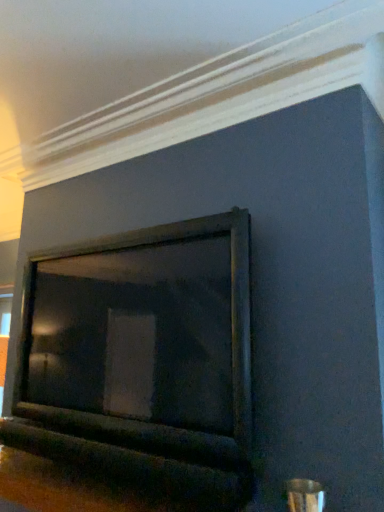
At what (x,y) coordinates should I click in order to perform the action: click on metallic silver fireplace at center. Please return your answer as a coordinate pair (x, y). Looking at the image, I should click on (138, 369).

This screenshot has width=384, height=512. What do you see at coordinates (138, 369) in the screenshot?
I see `metallic silver fireplace at center` at bounding box center [138, 369].

Measure the distance between metallic silver fireplace at center and camera.

The distance of metallic silver fireplace at center from camera is 1.22 meters.

You are a GUI agent. You are given a task and a screenshot of the screen. Output one action in this format:
    pyautogui.click(x=<x>, y=<y>)
    Task: Click on the metallic silver fireplace at center
    Image resolution: width=384 pixels, height=512 pixels.
    Given the screenshot: What is the action you would take?
    pyautogui.click(x=138, y=369)